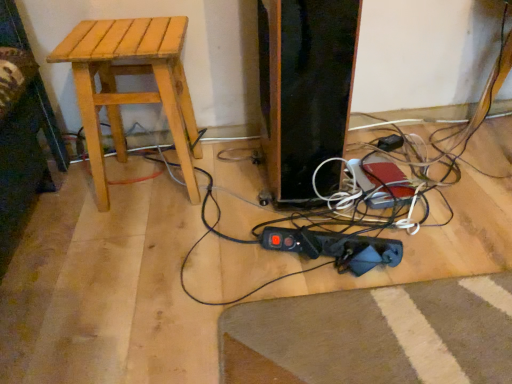
Question: Is black plastic plug at lower right wider or thinner than light brown wood stool at left?

Choices:
 (A) wide
 (B) thin

Answer: (B)

Question: From the image's perspective, is black plastic plug at lower right located above or below light brown wood stool at left?

Choices:
 (A) below
 (B) above

Answer: (A)

Question: Considering their positions, is black plastic plug at lower right located in front of or behind light brown wood stool at left?

Choices:
 (A) front
 (B) behind

Answer: (B)

Question: Is light brown wood stool at left to the left or to the right of black plastic plug at lower right in the image?

Choices:
 (A) left
 (B) right

Answer: (A)

Question: Does point (100, 59) appear closer or farther from the camera than point (382, 145)?

Choices:
 (A) closer
 (B) farther

Answer: (A)

Question: Looking at the image, does light brown wood stool at left seem bigger or smaller compared to black plastic plug at lower right?

Choices:
 (A) big
 (B) small

Answer: (A)

Question: Is light brown wood stool at left situated inside black plastic plug at lower right or outside?

Choices:
 (A) outside
 (B) inside

Answer: (A)